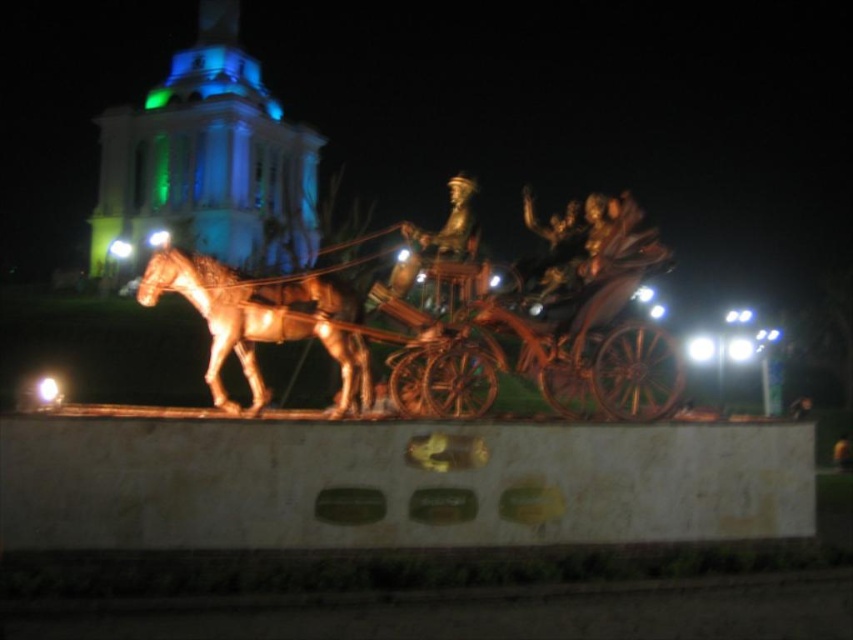
Question: Which point is farther to the camera?

Choices:
 (A) (611, 381)
 (B) (339, 330)

Answer: (A)

Question: Can you confirm if gold-bronze horse cart at center is wider than shiny gold horse at left?

Choices:
 (A) no
 (B) yes

Answer: (B)

Question: Which point is closer to the camera?

Choices:
 (A) (340, 412)
 (B) (614, 406)

Answer: (B)

Question: Is gold-bronze horse cart at center positioned before shiny gold horse at left?

Choices:
 (A) no
 (B) yes

Answer: (B)

Question: Can you confirm if gold-bronze horse cart at center is positioned above shiny gold horse at left?

Choices:
 (A) no
 (B) yes

Answer: (B)